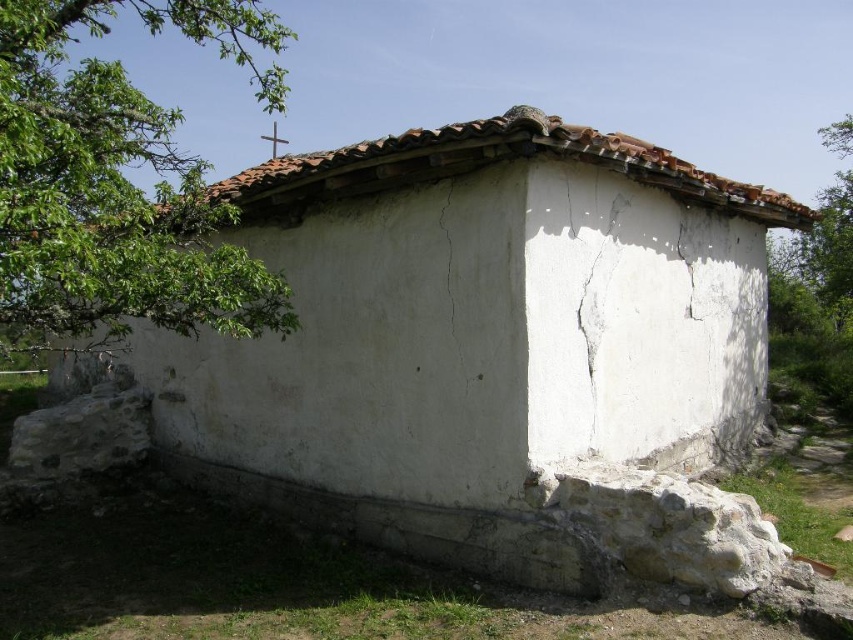
Question: Does green leafy branch at upper left have a smaller size compared to brown tile roof at upper center?

Choices:
 (A) yes
 (B) no

Answer: (B)

Question: Estimate the real-world distances between objects in this image. Which object is farther from the brown tile roof at upper center?

Choices:
 (A) green leafy tree at upper right
 (B) green leafy branch at upper left
 (C) white plaster crack at upper center
 (D) white plastered hut at center

Answer: (A)

Question: Is brown tile roof at upper center closer to the viewer compared to green leafy tree at upper right?

Choices:
 (A) no
 (B) yes

Answer: (B)

Question: Does green leafy branch at upper left lie in front of brown tile roof at upper center?

Choices:
 (A) no
 (B) yes

Answer: (B)

Question: Which point is closer to the camera?

Choices:
 (A) white plaster crack at upper center
 (B) green leafy tree at upper right
 (C) green leafy branch at upper left
 (D) white plastered hut at center

Answer: (C)

Question: Which point is closer to the camera?

Choices:
 (A) (802, 323)
 (B) (682, 412)
 (C) (114, 102)
 (D) (560, 131)

Answer: (D)